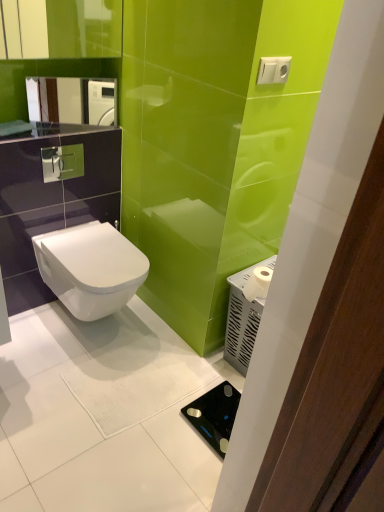
Question: From the image's perspective, is white matte toilet paper at right below white glossy toilet at center?

Choices:
 (A) no
 (B) yes

Answer: (B)

Question: Could you tell me if white matte toilet paper at right is facing white glossy toilet at center?

Choices:
 (A) no
 (B) yes

Answer: (A)

Question: Is white glossy toilet at center inside white matte toilet paper at right?

Choices:
 (A) yes
 (B) no

Answer: (B)

Question: Can you confirm if white matte toilet paper at right is thinner than white glossy toilet at center?

Choices:
 (A) no
 (B) yes

Answer: (B)

Question: Is white matte toilet paper at right completely or partially outside of white glossy toilet at center?

Choices:
 (A) no
 (B) yes

Answer: (B)

Question: Considering the relative positions of white matte toilet paper at right and white glossy toilet at center in the image provided, is white matte toilet paper at right to the left of white glossy toilet at center from the viewer's perspective?

Choices:
 (A) no
 (B) yes

Answer: (A)

Question: From a real-world perspective, does white matte toilet paper at right sit lower than black glass scale at lower right?

Choices:
 (A) no
 (B) yes

Answer: (A)

Question: Would you say white matte toilet paper at right is a long distance from black glass scale at lower right?

Choices:
 (A) no
 (B) yes

Answer: (A)

Question: From a real-world perspective, is white matte toilet paper at right on black glass scale at lower right?

Choices:
 (A) yes
 (B) no

Answer: (A)

Question: Can you see white matte toilet paper at right touching black glass scale at lower right?

Choices:
 (A) yes
 (B) no

Answer: (B)

Question: Does white matte toilet paper at right turn towards black glass scale at lower right?

Choices:
 (A) no
 (B) yes

Answer: (A)

Question: Is white matte toilet paper at right taller than black glass scale at lower right?

Choices:
 (A) no
 (B) yes

Answer: (B)

Question: Can you confirm if white glossy toilet at center is thinner than white matte toilet paper at right?

Choices:
 (A) no
 (B) yes

Answer: (A)